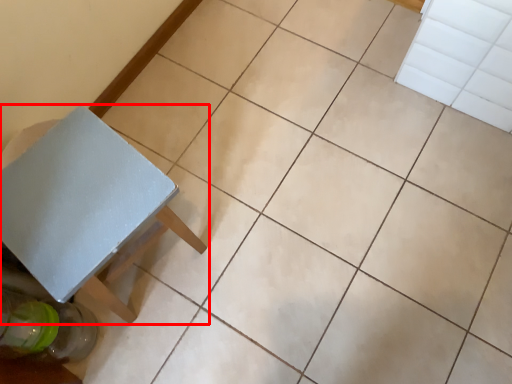
Question: Where is table (annotated by the red box) located in relation to glass bottle in the image?

Choices:
 (A) left
 (B) right

Answer: (B)